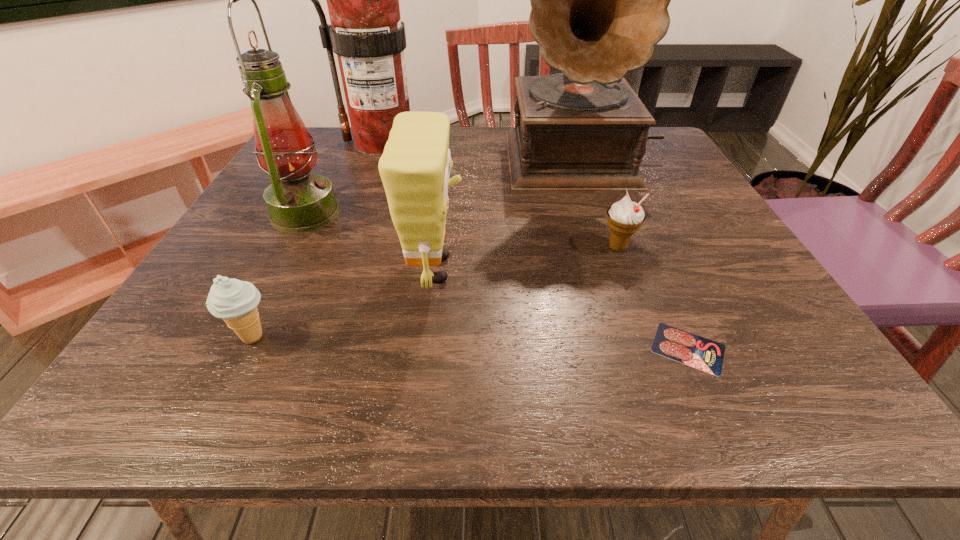
The image size is (960, 540). I want to click on free space between the fire extinguisher and the oil lamp, so click(x=344, y=178).

Identify which object is located as the sixth nearest to the record player. Please provide its 2D coordinates. Your answer should be formatted as a tuple, i.e. [(x, y)], where the tuple contains the x and y coordinates of a point satisfying the conditions above.

[(235, 301)]

Identify which object is located as the third nearest to the sponge. Please provide its 2D coordinates. Your answer should be formatted as a tuple, i.e. [(x, y)], where the tuple contains the x and y coordinates of a point satisfying the conditions above.

[(599, 0)]

This screenshot has height=540, width=960. In order to click on vacant space that satisfies the following two spatial constraints: 1. on the front side of the third tallest object; 2. on the left side of the nearer icecream in this screenshot , I will do `click(241, 337)`.

Find the location of a particular element. vacant region that satisfies the following two spatial constraints: 1. on the front side of the shortest object; 2. on the left side of the farther icecream is located at coordinates (656, 348).

Identify the location of free region that satisfies the following two spatial constraints: 1. at the nozzle of the fire extinguisher; 2. on the right side of the right icecream. (345, 247).

Where is `free space that satisfies the following two spatial constraints: 1. from the horn of the record player; 2. on the face of the sponge`? free space that satisfies the following two spatial constraints: 1. from the horn of the record player; 2. on the face of the sponge is located at coordinates (624, 270).

At what (x,y) coordinates should I click in order to perform the action: click on free space that satisfies the following two spatial constraints: 1. at the nozzle of the salami; 2. on the left side of the fire extinguisher. Please return your answer as a coordinate pair (x, y). The image size is (960, 540). Looking at the image, I should click on [307, 348].